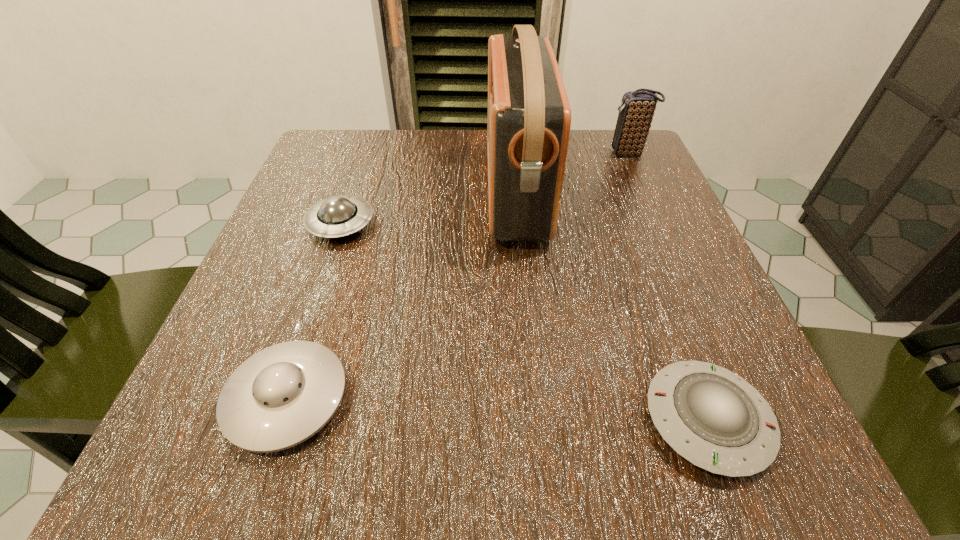
Identify the location of the third object from right to left. The height and width of the screenshot is (540, 960). (529, 117).

The image size is (960, 540). Find the location of `the tallest object`. the tallest object is located at coordinates (529, 117).

Where is `clutch bag`? This screenshot has width=960, height=540. clutch bag is located at coordinates (636, 111).

You are a GUI agent. You are given a task and a screenshot of the screen. Output one action in this format:
    pyautogui.click(x=<x>, y=<y>)
    Task: Click on the farthest saucer
    
    Given the screenshot: What is the action you would take?
    pyautogui.click(x=338, y=216)

The width and height of the screenshot is (960, 540). I want to click on the shortest saucer, so click(713, 418).

Where is `the rightmost saucer`? The height and width of the screenshot is (540, 960). the rightmost saucer is located at coordinates (713, 418).

Find the location of `vacant space located 0.200m on the front-facing side of the radio receiver`. vacant space located 0.200m on the front-facing side of the radio receiver is located at coordinates (386, 193).

Locate an element on the screen. Image resolution: width=960 pixels, height=540 pixels. vacant space situated on the front-facing side of the radio receiver is located at coordinates (366, 193).

Locate an element on the screen. The height and width of the screenshot is (540, 960). blank space located 0.220m on the front-facing side of the radio receiver is located at coordinates (376, 193).

Locate an element on the screen. The width and height of the screenshot is (960, 540). vacant point located with the zip open on the clutch bag is located at coordinates (517, 154).